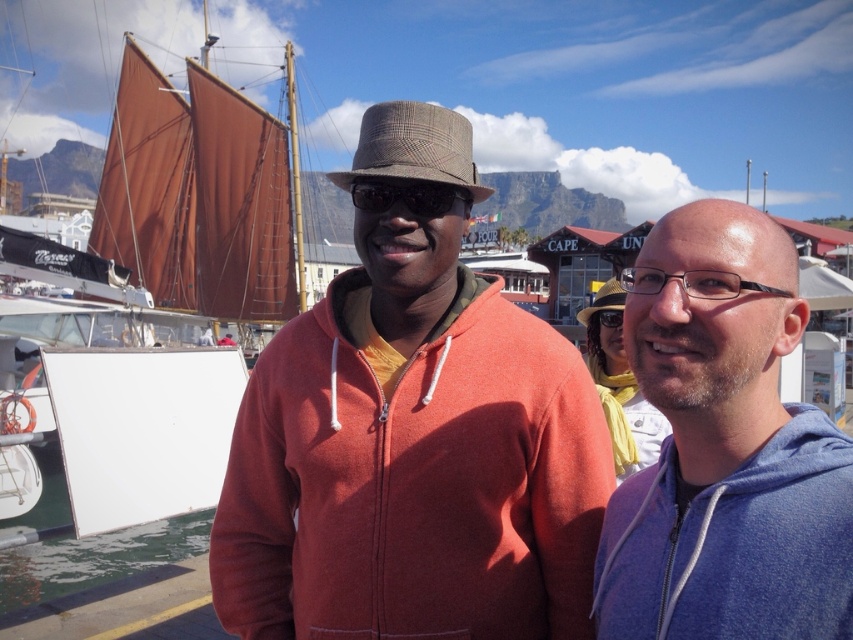
You are a photographer trying to capture a clear shot of the blue fleece jacket at right and the black plastic glasses at right. Since you want both items to be visible in your photo, which object should you focus on to ensure the other remains in the frame?

The blue fleece jacket at right is taller than the black plastic glasses at right, so focusing on the taller object will ensure the shorter one stays in frame.

You are a photographer standing at the marina and want to take a photo of the two people. You notice the blue fleece jacket at right and the black plastic glasses at right. Which object should you focus on first if you want to capture both in the same frame without moving the camera?

The blue fleece jacket at right is located below the black plastic glasses at right, so focusing on the black plastic glasses at right first would ensure both objects are in the frame since the jacket is positioned lower.